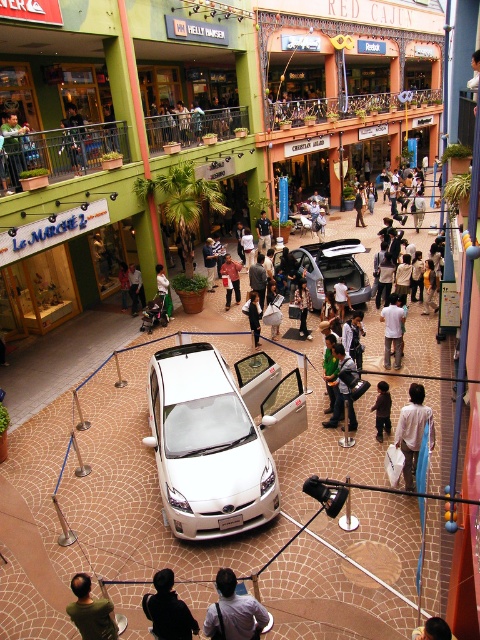
You are a shopper in the mall and see both the light brown fabric bag at center and the light brown leather jacket at center. Which item is positioned more to the left side?

The light brown fabric bag at center is positioned more to the left side than the light brown leather jacket at center.

You are a shopper in the mall and want to pick up both the light brown fabric bag at center and the dark green shirt at lower left. Which item will you reach first if you walk straight ahead?

You will reach the light brown fabric bag at center first because it is closer to you than the dark green shirt at lower left, which is further away.

You are a shopper at the mall and see the light brown fabric bag at center and the dark green shirt at lower left. Which item has a smaller width when viewed from above?

The light brown fabric bag at center is thinner than the dark green shirt at lower left, so the light brown fabric bag at center has a smaller width when viewed from above.